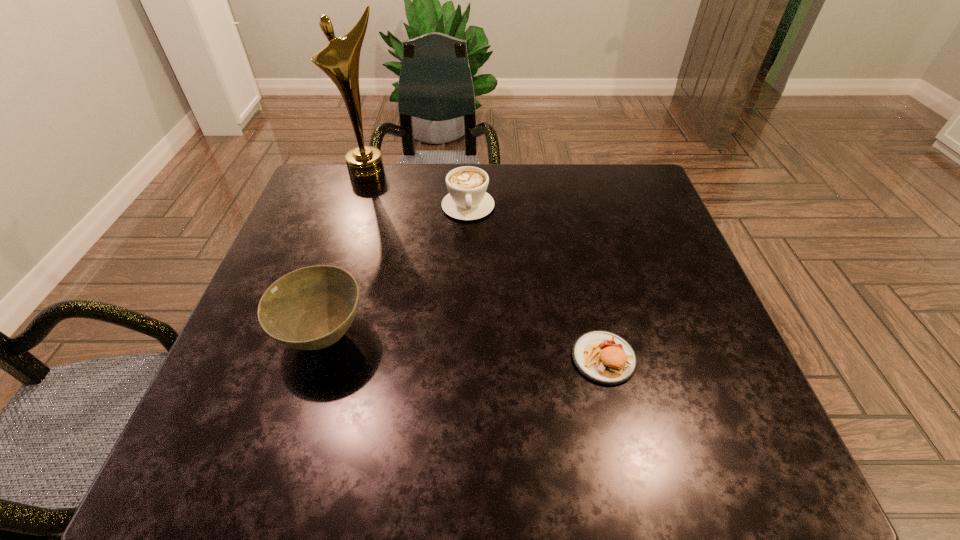
Where is `free spot on the desktop that is between the bowl and the rightmost object and is positioned to the right of the cappuccino's handle`? free spot on the desktop that is between the bowl and the rightmost object and is positioned to the right of the cappuccino's handle is located at coordinates (491, 349).

At what (x,y) coordinates should I click in order to perform the action: click on vacant space on the desktop that is between the bowl and the rightmost object and is positioned on the front-facing side of the award. Please return your answer as a coordinate pair (x, y). Image resolution: width=960 pixels, height=540 pixels. Looking at the image, I should click on (440, 345).